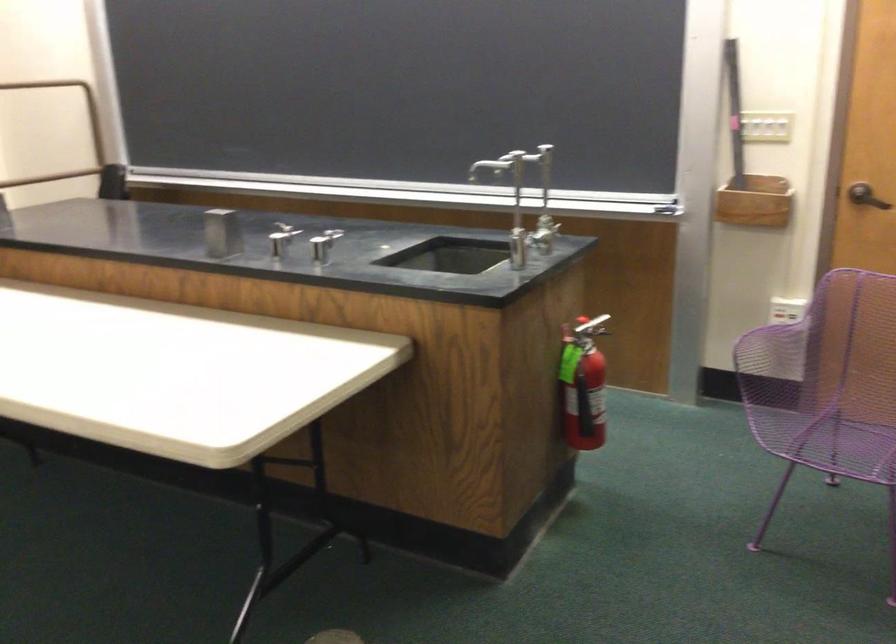
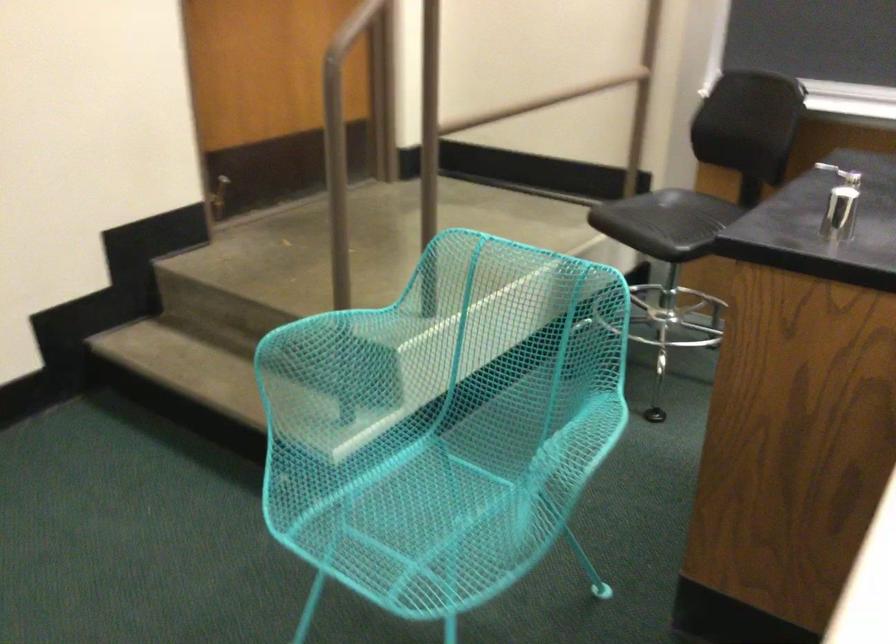
Which direction would the cameraman need to move to produce the second image?

The cameraman moved toward left, forward.